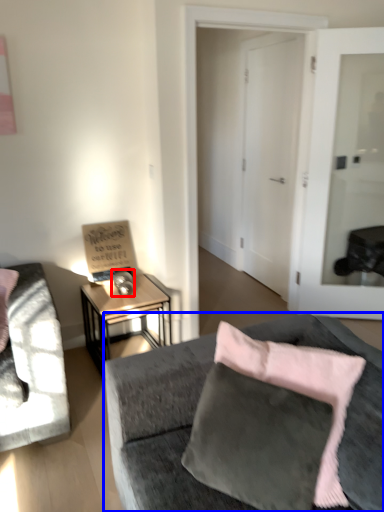
Question: Which point is closer to the camera, table lamp (highlighted by a red box) or studio couch (highlighted by a blue box)?

Choices:
 (A) table lamp
 (B) studio couch

Answer: (B)